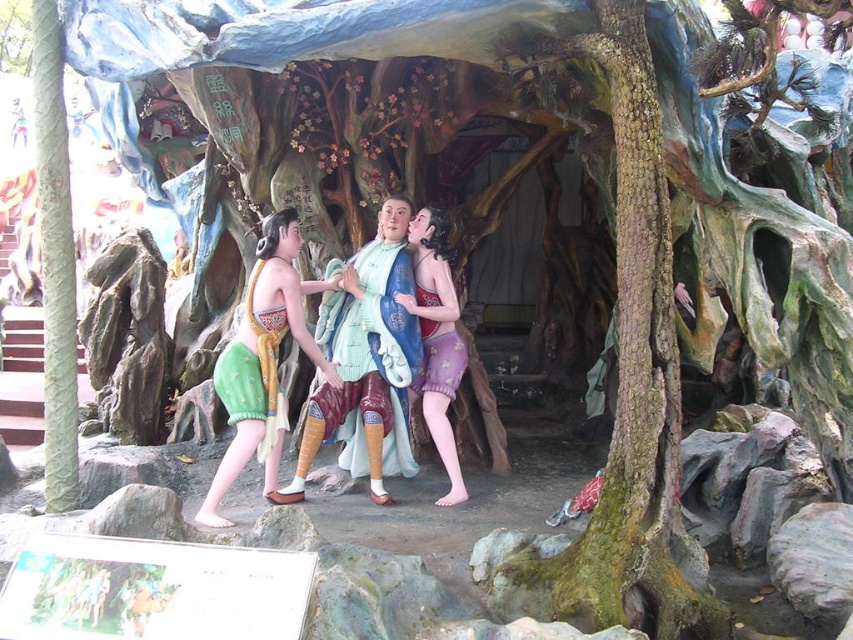
You are an observer standing at the entrance of the cave. You notice two skirts in the center of the scene. Which one is closer to you, the green fabric skirt at center or the matte purple fabric skirt at center?

The green fabric skirt at center is closer to you because it is in front of the matte purple fabric skirt at center.